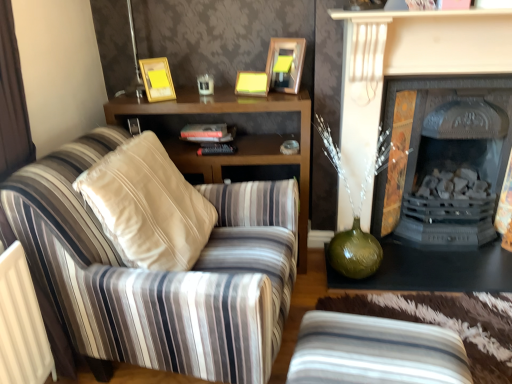
Question: From a real-world perspective, is hardcover book at center physically below gold metallic picture frame at upper center, which ranks as the second picture frame in right-to-left order?

Choices:
 (A) no
 (B) yes

Answer: (B)

Question: Does hardcover book at center come behind gold metallic picture frame at upper center, which ranks as the second picture frame in right-to-left order?

Choices:
 (A) no
 (B) yes

Answer: (B)

Question: Can we say hardcover book at center lies outside gold metallic picture frame at upper center, the first picture frame from the left?

Choices:
 (A) no
 (B) yes

Answer: (B)

Question: Is hardcover book at center at the left side of gold metallic picture frame at upper center, the first picture frame from the left?

Choices:
 (A) no
 (B) yes

Answer: (A)

Question: Is hardcover book at center aimed at gold metallic picture frame at upper center, the first picture frame from the left?

Choices:
 (A) no
 (B) yes

Answer: (A)

Question: Is hardcover book at center facing away from gold metallic picture frame at upper center, the first picture frame from the left?

Choices:
 (A) yes
 (B) no

Answer: (B)

Question: Is black cast iron fireplace at right, which is counted as the 2th fireplace, starting from the front, facing away from striped fabric armchair at left?

Choices:
 (A) no
 (B) yes

Answer: (A)

Question: Is black cast iron fireplace at right, which is counted as the 2th fireplace, starting from the front, aimed at striped fabric armchair at left?

Choices:
 (A) no
 (B) yes

Answer: (A)

Question: Can you see black cast iron fireplace at right, which is counted as the 2th fireplace, starting from the front, touching striped fabric armchair at left?

Choices:
 (A) yes
 (B) no

Answer: (B)

Question: Is black cast iron fireplace at right, which is counted as the 2th fireplace, starting from the front, closer to camera compared to striped fabric armchair at left?

Choices:
 (A) yes
 (B) no

Answer: (B)

Question: From the image's perspective, is black cast iron fireplace at right, which is counted as the 2th fireplace, starting from the front, below striped fabric armchair at left?

Choices:
 (A) no
 (B) yes

Answer: (A)

Question: Does wooden cabinet at center have a greater height compared to matte black fireplace at center, acting as the first fireplace starting from the front?

Choices:
 (A) no
 (B) yes

Answer: (A)